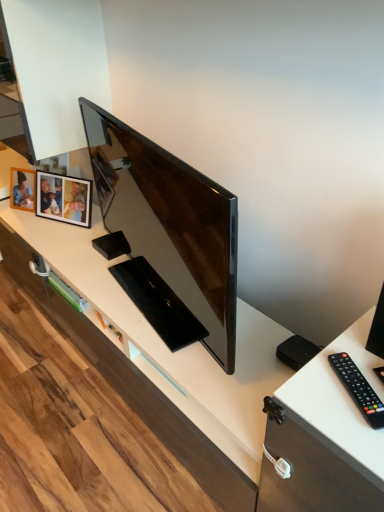
Question: Considering the relative positions of matte black tv at center and wooden photo frame at upper left in the image provided, is matte black tv at center to the left of wooden photo frame at upper left from the viewer's perspective?

Choices:
 (A) yes
 (B) no

Answer: (B)

Question: Is wooden photo frame at upper left at the back of matte black tv at center?

Choices:
 (A) no
 (B) yes

Answer: (A)

Question: From a real-world perspective, is matte black tv at center on wooden photo frame at upper left?

Choices:
 (A) yes
 (B) no

Answer: (A)

Question: Is matte black tv at center oriented towards wooden photo frame at upper left?

Choices:
 (A) no
 (B) yes

Answer: (A)

Question: From the image's perspective, is matte black tv at center under wooden photo frame at upper left?

Choices:
 (A) no
 (B) yes

Answer: (B)

Question: Visually, is black plastic remote at right positioned to the left or to the right of matte black tv at center?

Choices:
 (A) right
 (B) left

Answer: (A)

Question: Is point (365, 386) closer or farther from the camera than point (187, 177)?

Choices:
 (A) farther
 (B) closer

Answer: (B)

Question: Relative to matte black tv at center, is black plastic remote at right in front or behind?

Choices:
 (A) front
 (B) behind

Answer: (A)

Question: From the image's perspective, relative to matte black tv at center, is black plastic remote at right above or below?

Choices:
 (A) below
 (B) above

Answer: (A)

Question: Does point (64, 211) appear closer or farther from the camera than point (342, 379)?

Choices:
 (A) farther
 (B) closer

Answer: (A)

Question: From a real-world perspective, is wooden photo frame at upper left physically located above or below black plastic remote at right?

Choices:
 (A) above
 (B) below

Answer: (B)

Question: Is wooden photo frame at upper left inside the boundaries of black plastic remote at right, or outside?

Choices:
 (A) outside
 (B) inside

Answer: (A)

Question: Is wooden photo frame at upper left taller or shorter than black plastic remote at right?

Choices:
 (A) short
 (B) tall

Answer: (B)

Question: From a real-world perspective, relative to wooden photo frame at upper left, is matte black tv at center vertically above or below?

Choices:
 (A) below
 (B) above

Answer: (B)

Question: Considering the positions of matte black tv at center and wooden photo frame at upper left in the image, is matte black tv at center bigger or smaller than wooden photo frame at upper left?

Choices:
 (A) small
 (B) big

Answer: (B)